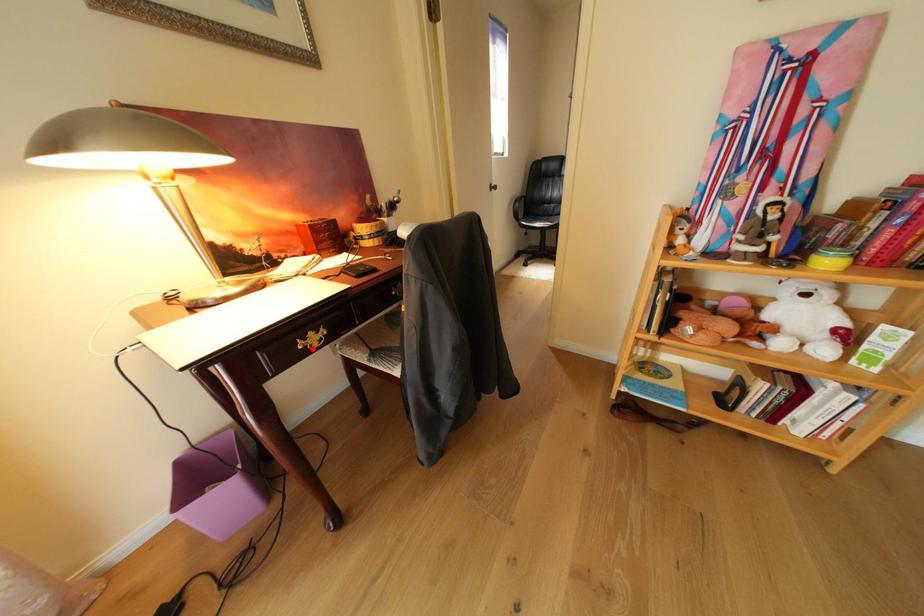
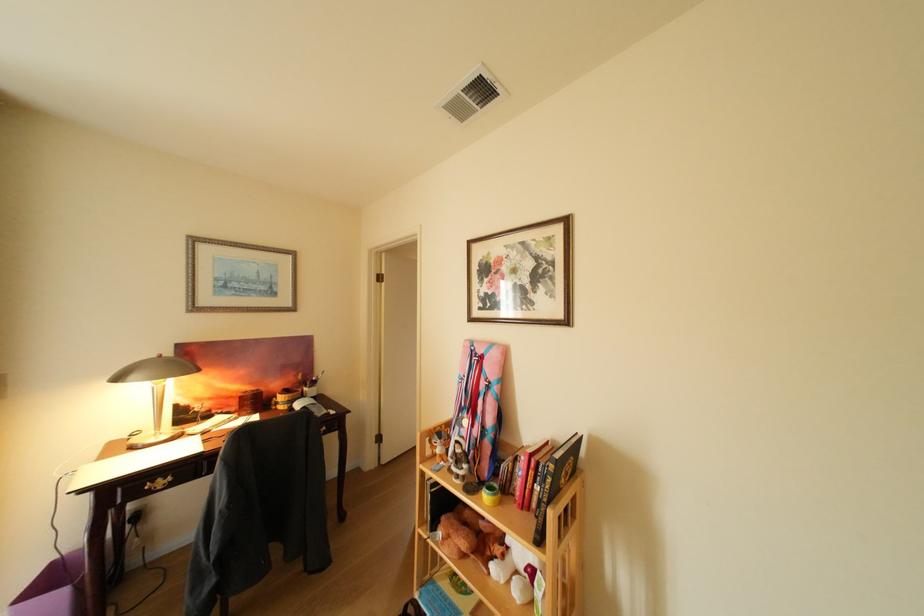
Question: I am providing you with two images of the same scene from different viewpoints. In image1, a red point is highlighted. Considering the same 3D point in image2, which of the following is correct?

Choices:
 (A) It is closer
 (B) It is farther

Answer: (B)